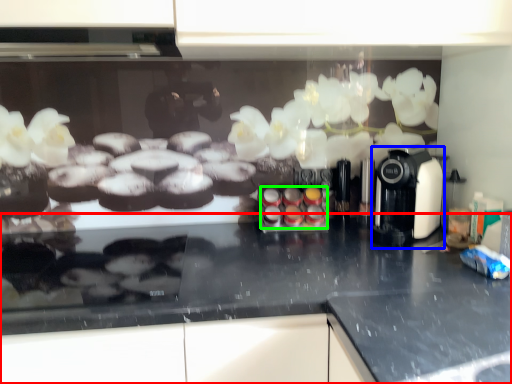
Question: Which is nearer to the countertop (highlighted by a red box)? coffee machine (highlighted by a blue box) or food (highlighted by a green box).

Choices:
 (A) coffee machine
 (B) food

Answer: (A)